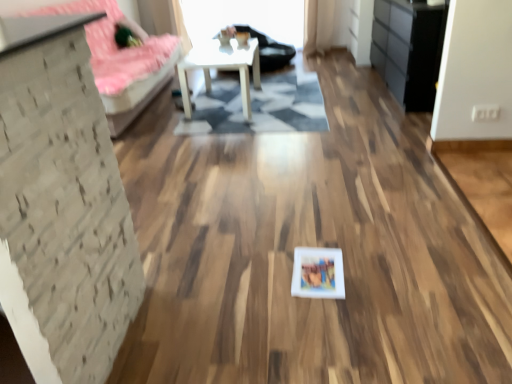
The height and width of the screenshot is (384, 512). Describe the element at coordinates (222, 68) in the screenshot. I see `white matte table at center` at that location.

In order to click on black matte dresser at right in this screenshot , I will do `click(408, 50)`.

You are a GUI agent. You are given a task and a screenshot of the screen. Output one action in this format:
    pyautogui.click(x=<x>, y=<y>)
    Task: Click on the matte white picture frame at center
    
    Given the screenshot: What is the action you would take?
    pyautogui.click(x=318, y=273)

Considering the positions of objects white fabric couch at left and geometric rug at center in the image provided, who is more to the left, white fabric couch at left or geometric rug at center?

white fabric couch at left is more to the left.

How distant is white fabric couch at left from geometric rug at center?

A distance of 31.45 inches exists between white fabric couch at left and geometric rug at center.

Could you tell me if white fabric couch at left is facing geometric rug at center?

Yes, white fabric couch at left faces towards geometric rug at center.

Is white fabric couch at left not close to geometric rug at center?

white fabric couch at left is actually quite close to geometric rug at center.

Who is taller, geometric rug at center or white fabric couch at left?

white fabric couch at left is taller.

Is geometric rug at center beside white fabric couch at left?

geometric rug at center and white fabric couch at left are clearly separated.

From a real-world perspective, who is located higher, geometric rug at center or white fabric couch at left?

white fabric couch at left.

How different are the orientations of geometric rug at center and white fabric couch at left in degrees?

There is a 90.1-degree angle between the facing directions of geometric rug at center and white fabric couch at left.

Is matte white picture frame at center to the left of black matte dresser at right from the viewer's perspective?

Indeed, matte white picture frame at center is positioned on the left side of black matte dresser at right.

Is matte white picture frame at center facing towards black matte dresser at right?

No, matte white picture frame at center does not turn towards black matte dresser at right.

Can you confirm if matte white picture frame at center is bigger than black matte dresser at right?

No, matte white picture frame at center is not bigger than black matte dresser at right.

Is matte white picture frame at center wider than black matte dresser at right?

In fact, matte white picture frame at center might be narrower than black matte dresser at right.

Between white fabric couch at left and matte white picture frame at center, which one has larger size?

With larger size is white fabric couch at left.

Can matte white picture frame at center be found inside white fabric couch at left?

No, matte white picture frame at center is not a part of white fabric couch at left.

From the image's perspective, which one is positioned lower, white fabric couch at left or matte white picture frame at center?

matte white picture frame at center is shown below in the image.

Is white matte table at center not near geometric rug at center?

That's not correct — white matte table at center is a little close to geometric rug at center.

Find the location of a particular element. table to the left of geometric rug at center is located at coordinates (222, 68).

Considering the relative sizes of white matte table at center and geometric rug at center in the image provided, is white matte table at center bigger than geometric rug at center?

Yes, white matte table at center is bigger than geometric rug at center.

Does white matte table at center have a greater width compared to geometric rug at center?

No.

From the image's perspective, who appears lower, matte white picture frame at center or geometric rug at center?

matte white picture frame at center is shown below in the image.

Is matte white picture frame at center aimed at geometric rug at center?

Yes, matte white picture frame at center is oriented towards geometric rug at center.

Between matte white picture frame at center and geometric rug at center, which one has larger width?

geometric rug at center is wider.

Is matte white picture frame at center inside the boundaries of geometric rug at center, or outside?

matte white picture frame at center lies outside geometric rug at center.

Which object is closer to the camera, black matte dresser at right or white fabric couch at left?

white fabric couch at left is in front.

Is black matte dresser at right facing away from white fabric couch at left?

No, white fabric couch at left is not at the back of black matte dresser at right.

Looking at their sizes, would you say black matte dresser at right is wider or thinner than white fabric couch at left?

In the image, black matte dresser at right appears to be more narrow than white fabric couch at left.

Is point (437, 21) less distant than point (158, 66)?

Yes, it is in front of point (158, 66).

The width and height of the screenshot is (512, 384). I want to click on couch to the left of geometric rug at center, so click(x=121, y=62).

The image size is (512, 384). Identify the location of mat located on the right of white fabric couch at left. (260, 106).

Looking at the image, which one is located closer to matte white picture frame at center, geometric rug at center or black matte dresser at right?

geometric rug at center is closer to matte white picture frame at center.

Which object lies nearer to the anchor point geometric rug at center, matte white picture frame at center or white fabric couch at left?

Based on the image, white fabric couch at left appears to be nearer to geometric rug at center.

Estimate the real-world distances between objects in this image. Which object is further from black matte dresser at right, white fabric couch at left or geometric rug at center?

white fabric couch at left.

Considering their positions, is white matte table at center positioned closer to white fabric couch at left than matte white picture frame at center?

Based on the image, white matte table at center appears to be nearer to white fabric couch at left.

From the picture: Which object lies nearer to the anchor point matte white picture frame at center, black matte dresser at right or geometric rug at center?

Among the two, geometric rug at center is located nearer to matte white picture frame at center.

From the image, which object appears to be nearer to black matte dresser at right, geometric rug at center or white fabric couch at left?

geometric rug at center is closer to black matte dresser at right.

Considering their positions, is white fabric couch at left positioned further to white matte table at center than matte white picture frame at center?

Among the two, matte white picture frame at center is located further to white matte table at center.

Which object lies further to the anchor point white matte table at center, white fabric couch at left or geometric rug at center?

white fabric couch at left is positioned further to the anchor white matte table at center.

This screenshot has height=384, width=512. What are the coordinates of `mat between black matte dresser at right and matte white picture frame at center from top to bottom` in the screenshot? It's located at (260, 106).

The image size is (512, 384). Identify the location of mat located between white matte table at center and black matte dresser at right in the left-right direction. (260, 106).

The width and height of the screenshot is (512, 384). I want to click on table between white fabric couch at left and black matte dresser at right in the horizontal direction, so click(222, 68).

Image resolution: width=512 pixels, height=384 pixels. I want to click on table that lies between white fabric couch at left and matte white picture frame at center from top to bottom, so pyautogui.click(x=222, y=68).